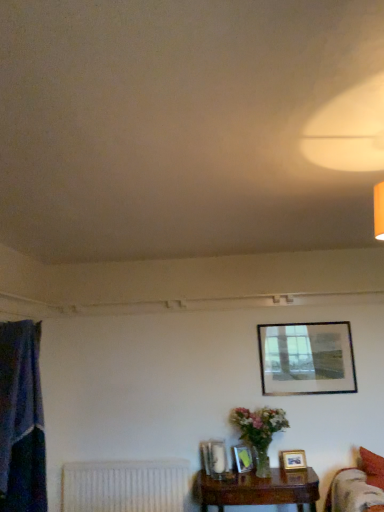
Question: Considering the relative sizes of matte plastic picture frame at lower center, the 3th picture frame when ordered from right to left, and matte glass picture frame at lower center, placed as the 4th picture frame when sorted from right to left, in the image provided, is matte plastic picture frame at lower center, the 3th picture frame when ordered from right to left, wider than matte glass picture frame at lower center, placed as the 4th picture frame when sorted from right to left,?

Choices:
 (A) yes
 (B) no

Answer: (B)

Question: Is matte plastic picture frame at lower center, placed as the fourth picture frame when sorted from top to bottom, looking in the opposite direction of matte glass picture frame at lower center, acting as the 1th picture frame starting from the left?

Choices:
 (A) yes
 (B) no

Answer: (B)

Question: Could you tell me if matte plastic picture frame at lower center, which is the second picture frame from left to right, is facing matte glass picture frame at lower center, which ranks as the 2th picture frame in top-to-bottom order?

Choices:
 (A) no
 (B) yes

Answer: (A)

Question: Is matte plastic picture frame at lower center, which is the second picture frame from left to right, placed right next to matte glass picture frame at lower center, which is counted as the 3th picture frame, starting from the bottom?

Choices:
 (A) no
 (B) yes

Answer: (A)

Question: Considering the relative sizes of matte plastic picture frame at lower center, placed as the fourth picture frame when sorted from top to bottom, and matte glass picture frame at lower center, which ranks as the 2th picture frame in top-to-bottom order, in the image provided, is matte plastic picture frame at lower center, placed as the fourth picture frame when sorted from top to bottom, thinner than matte glass picture frame at lower center, which ranks as the 2th picture frame in top-to-bottom order,?

Choices:
 (A) yes
 (B) no

Answer: (A)

Question: Does matte plastic picture frame at lower center, acting as the first picture frame starting from the bottom, have a smaller size compared to matte glass picture frame at lower center, acting as the 1th picture frame starting from the left?

Choices:
 (A) yes
 (B) no

Answer: (A)

Question: Does metallic silver picture frame at upper center, placed as the first picture frame when sorted from right to left, have a greater height compared to white textured radiator at lower left?

Choices:
 (A) no
 (B) yes

Answer: (B)

Question: Does metallic silver picture frame at upper center, placed as the first picture frame when sorted from right to left, have a larger size compared to white textured radiator at lower left?

Choices:
 (A) yes
 (B) no

Answer: (B)

Question: Is metallic silver picture frame at upper center, placed as the first picture frame when sorted from right to left, positioned with its back to white textured radiator at lower left?

Choices:
 (A) no
 (B) yes

Answer: (A)

Question: Considering the relative positions of metallic silver picture frame at upper center, which appears as the fourth picture frame when ordered from the bottom, and white textured radiator at lower left in the image provided, is metallic silver picture frame at upper center, which appears as the fourth picture frame when ordered from the bottom, to the right of white textured radiator at lower left from the viewer's perspective?

Choices:
 (A) no
 (B) yes

Answer: (B)

Question: Considering the relative sizes of metallic silver picture frame at upper center, arranged as the fourth picture frame when viewed from the left, and white textured radiator at lower left in the image provided, is metallic silver picture frame at upper center, arranged as the fourth picture frame when viewed from the left, shorter than white textured radiator at lower left?

Choices:
 (A) no
 (B) yes

Answer: (A)

Question: Are metallic silver picture frame at upper center, the first picture frame when ordered from top to bottom, and white textured radiator at lower left located far from each other?

Choices:
 (A) no
 (B) yes

Answer: (B)

Question: Is blue fabric curtain at left wider than matte plastic picture frame at lower center, placed as the fourth picture frame when sorted from top to bottom?

Choices:
 (A) yes
 (B) no

Answer: (A)